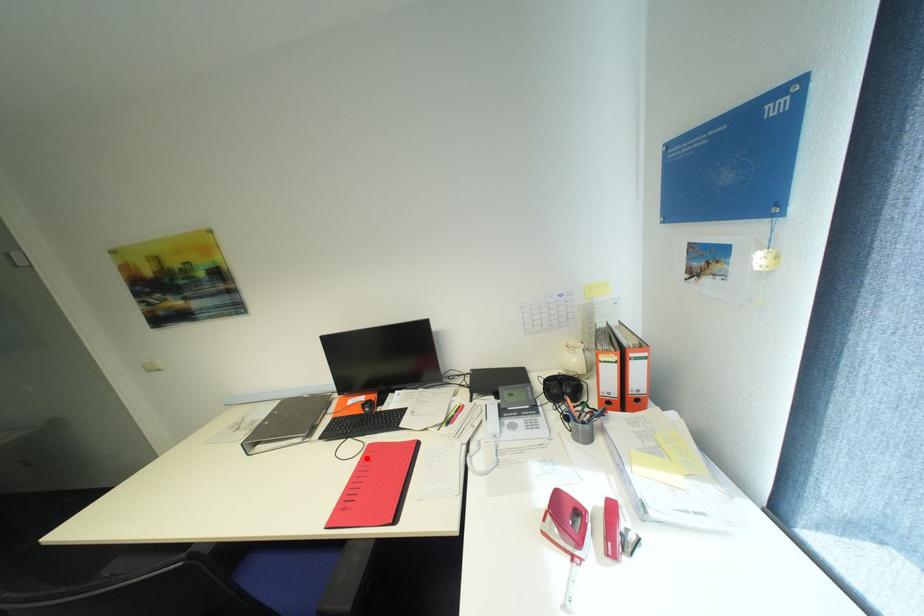
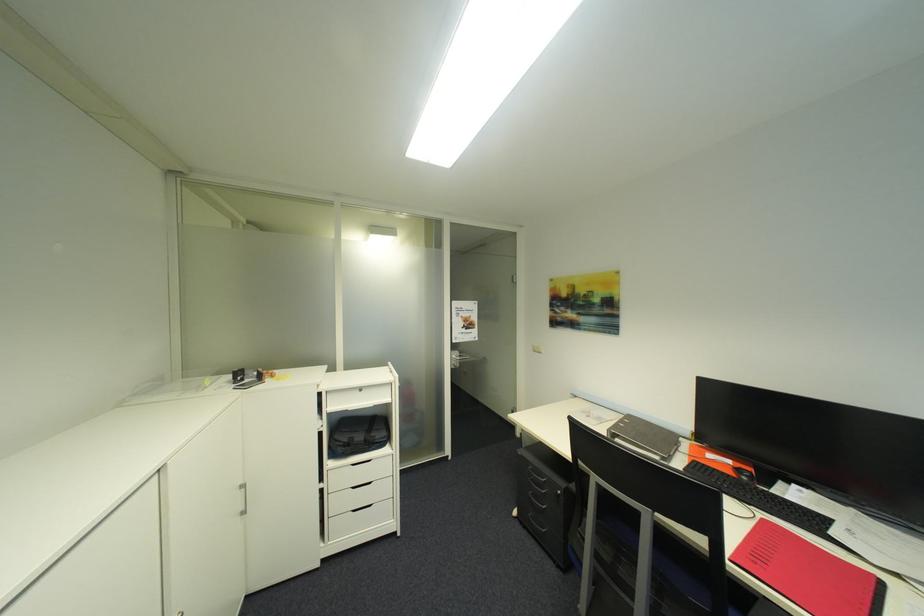
Question: A red point is marked in image1. In image2, is the corresponding 3D point closer to the camera or farther? Reply with the corresponding letter.

Choices:
 (A) The corresponding 3D point is closer.
 (B) The corresponding 3D point is farther.

Answer: (A)